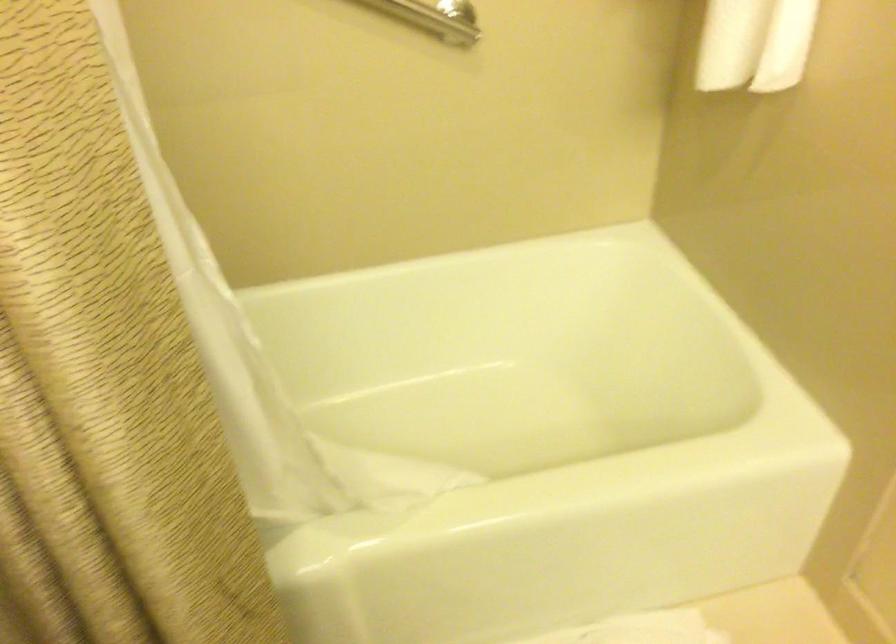
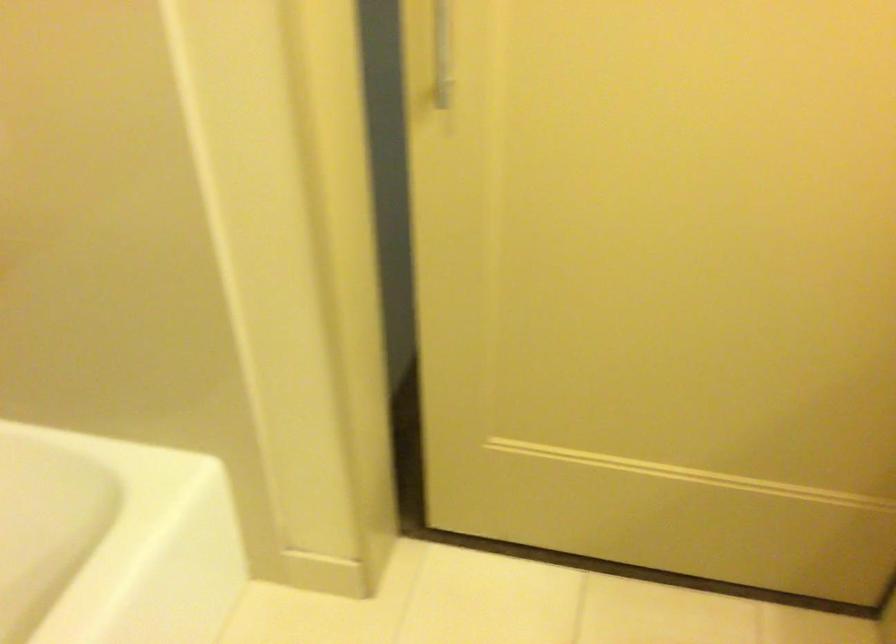
Question: The first image is from the beginning of the video and the second image is from the end. How did the camera likely rotate when shooting the video?

Choices:
 (A) Left
 (B) Right
 (C) Up
 (D) Down

Answer: (B)